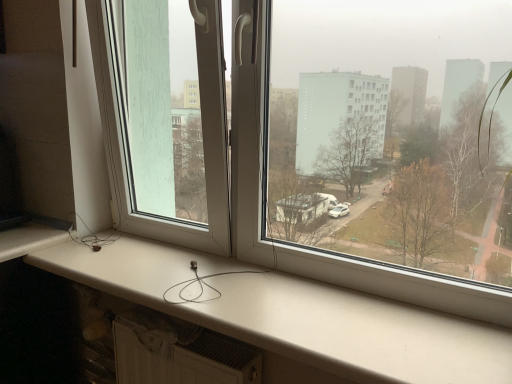
What are the coordinates of `vacant space to the left of transparent plastic window screen at left` in the screenshot? It's located at (72, 255).